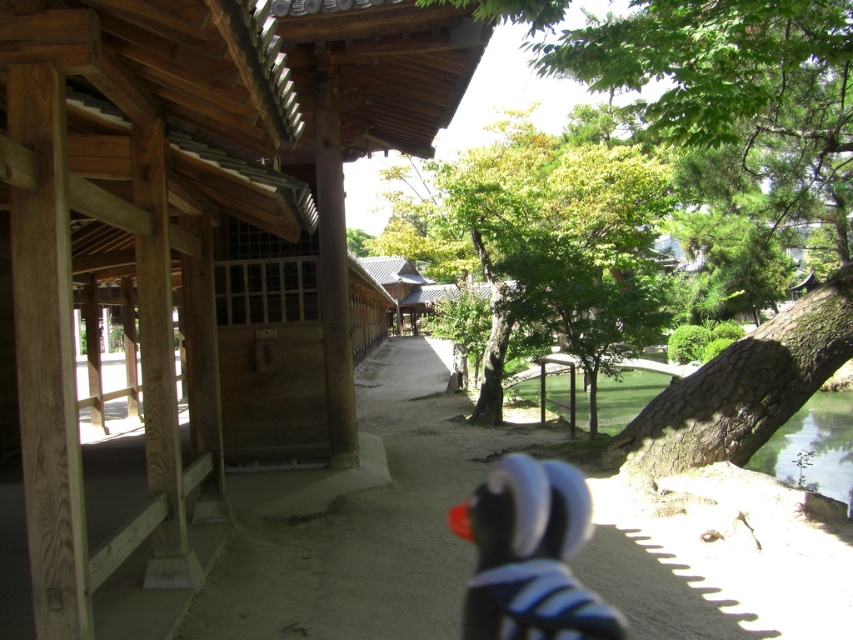
Question: Is wooden hut at center further to camera compared to green leafy tree at center?

Choices:
 (A) no
 (B) yes

Answer: (A)

Question: Which of the following is the farthest from the observer?

Choices:
 (A) wooden hut at center
 (B) black rubber duck at center

Answer: (B)

Question: Which of the following is the closest to the observer?

Choices:
 (A) (584, 504)
 (B) (32, 349)
 (C) (692, 112)

Answer: (B)

Question: From the image, what is the correct spatial relationship of wooden hut at center in relation to green leafy tree at center?

Choices:
 (A) below
 (B) above

Answer: (A)

Question: Is the position of wooden hut at center less distant than that of black rubber duck at center?

Choices:
 (A) yes
 (B) no

Answer: (A)

Question: Which point is farther from the camera taking this photo?

Choices:
 (A) (444, 17)
 (B) (840, 324)
 (C) (491, 577)

Answer: (B)